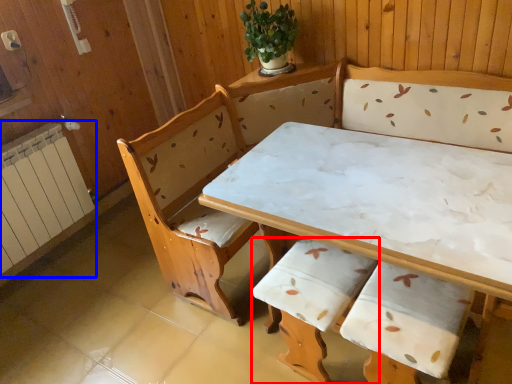
Question: Among these objects, which one is farthest to the camera, armchair (highlighted by a red box) or radiator (highlighted by a blue box)?

Choices:
 (A) armchair
 (B) radiator

Answer: (B)